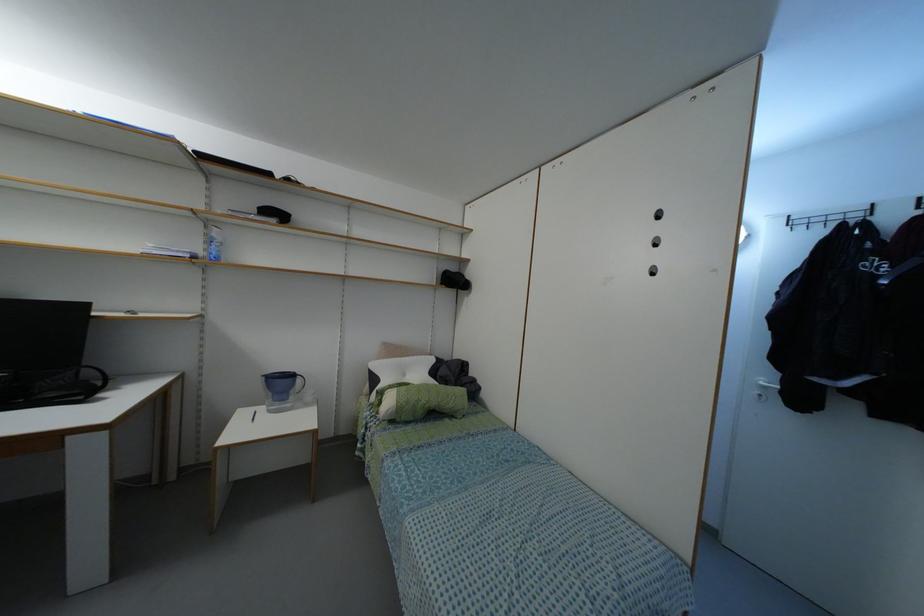
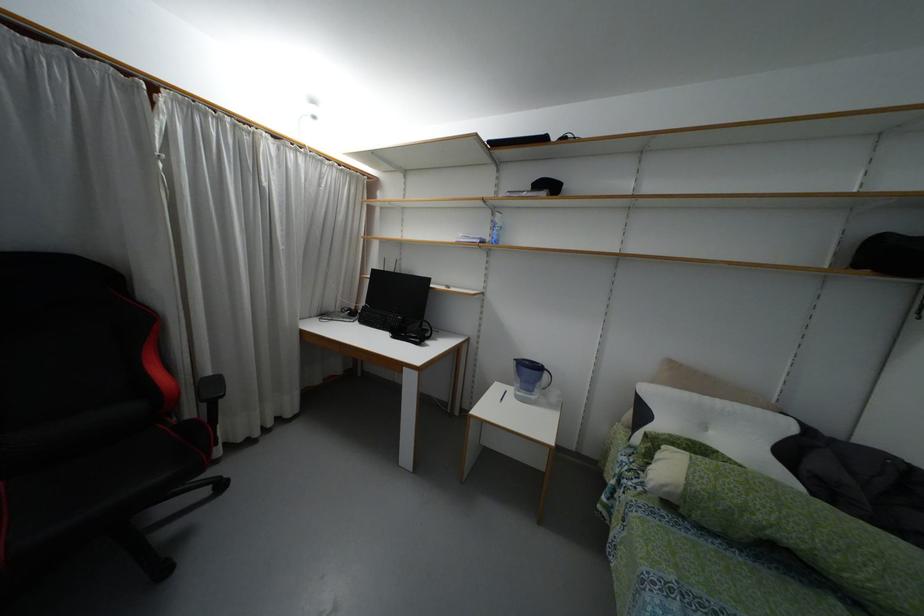
Where in the second image is the point corresponding to (207,223) from the first image?

(493, 209)